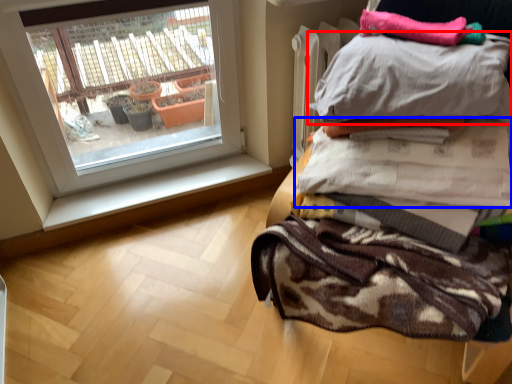
Question: Which of the following is the farthest to the observer, pillow (highlighted by a red box) or blanket (highlighted by a blue box)?

Choices:
 (A) pillow
 (B) blanket

Answer: (B)